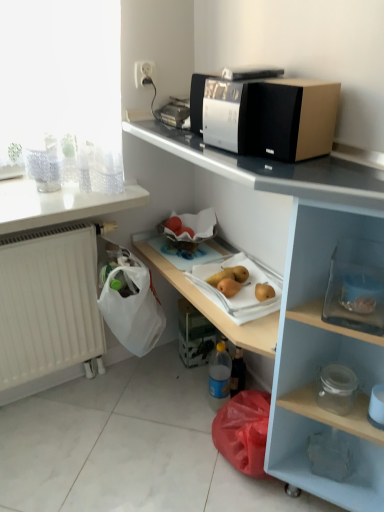
Identify the location of vacant region in front of translucent plastic container at lower center, placed as the 2th box when sorted from front to back. (185, 382).